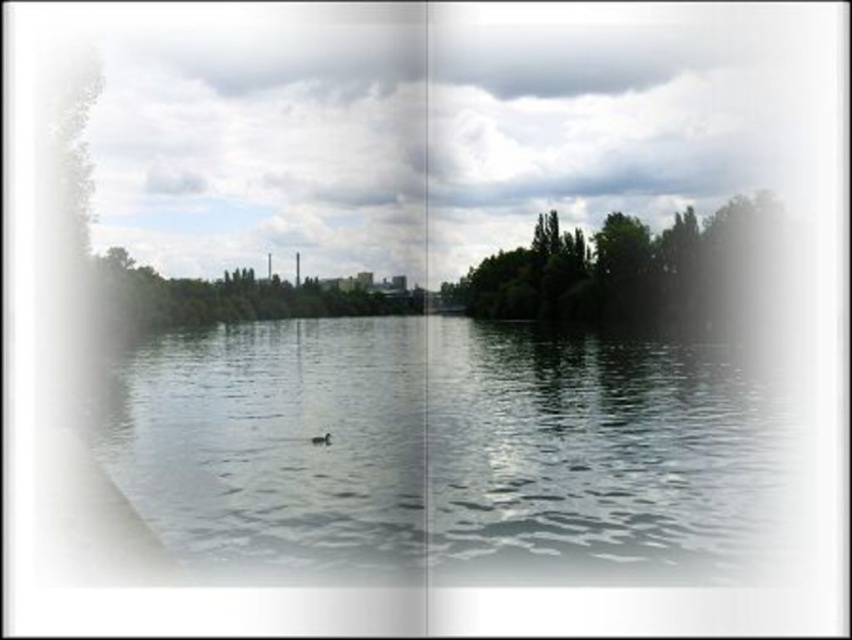
You are a photographer trying to capture the reflection of the brown matte duck at center in the clear water at center. Based on the scene, can you confirm if the duck is fully visible in its reflection?

The clear water at center is much taller as brown matte duck at center, so the duck is fully visible in its reflection.

You are standing at a point 106.51 feet away from the point labeled as point [729,525] in the image. If you want to walk towards that point, which direction should you head?

To reach point [729,525] from your current position 106.51 feet away, you should walk towards the direction of the point labeled as point [729,525].

You are standing at the point labeled point (x=525, y=547) and want to move towards the point labeled point (x=326, y=436). Which direction should you move to get closer to your destination?

To move from point (x=525, y=547) towards point (x=326, y=436), you should move diagonally towards the lower left direction since point (x=525, y=547) is closer to the camera than point (x=326, y=436).